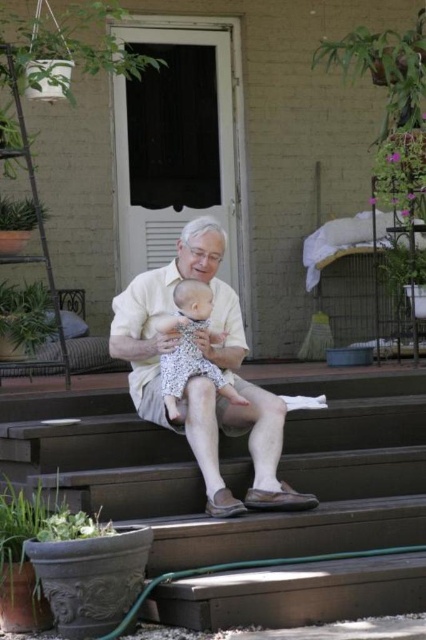
Question: Which object is farther from the camera taking this photo?

Choices:
 (A) brown wooden stairs at center
 (B) light beige cotton shirt at center

Answer: (B)

Question: Does brown wooden stairs at center have a lesser width compared to light beige cotton shirt at center?

Choices:
 (A) yes
 (B) no

Answer: (B)

Question: Which point is farther to the camera?

Choices:
 (A) white lace dress at center
 (B) light beige cotton shirt at center
 (C) brown wooden stairs at center

Answer: (A)

Question: From the image, what is the correct spatial relationship of brown wooden stairs at center in relation to light beige cotton shirt at center?

Choices:
 (A) below
 (B) above

Answer: (A)

Question: Among these points, which one is farthest from the camera?

Choices:
 (A) (186, 262)
 (B) (207, 291)
 (C) (207, 579)

Answer: (A)

Question: Can you confirm if light beige cotton shirt at center is thinner than white lace dress at center?

Choices:
 (A) yes
 (B) no

Answer: (B)